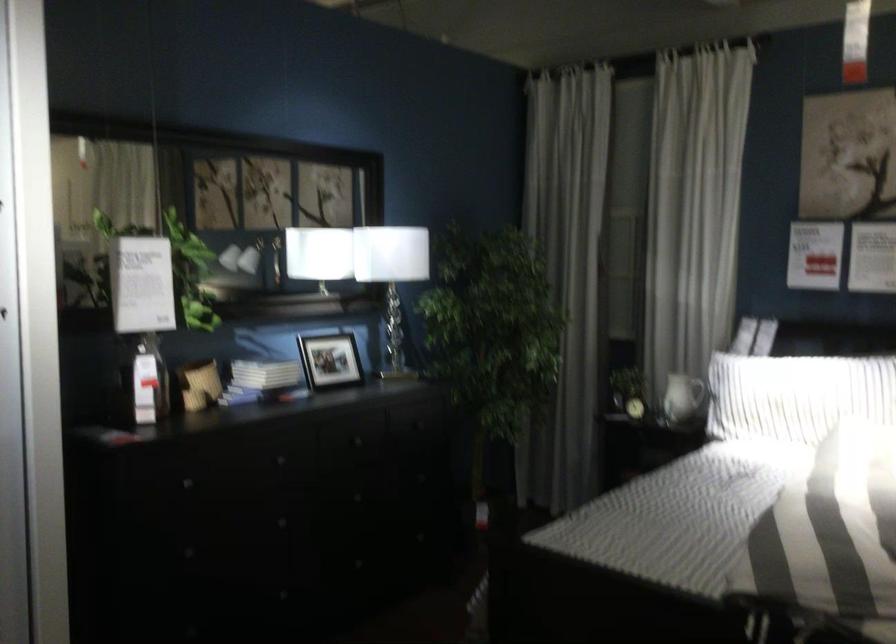
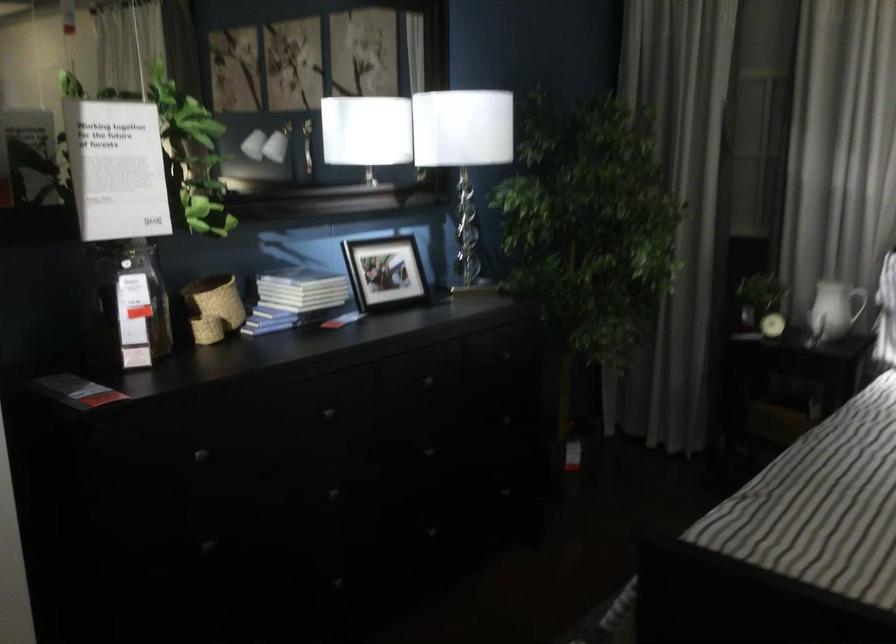
Find the pixel in the second image that matches pixel 140 379 in the first image.

(126, 305)